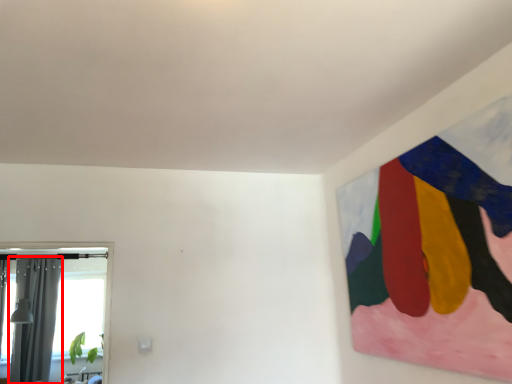
Question: From the image's perspective, where is curtain (annotated by the red box) located in relation to window in the image?

Choices:
 (A) above
 (B) below

Answer: (B)